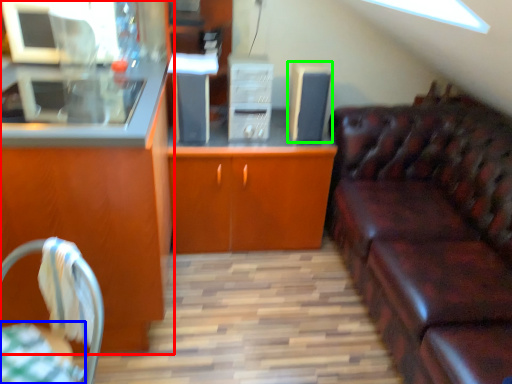
Question: Based on their relative distances, which object is farther from cabinetry (highlighted by a red box)? Choose from tablecloth (highlighted by a blue box) and appliance (highlighted by a green box).

Choices:
 (A) tablecloth
 (B) appliance

Answer: (B)